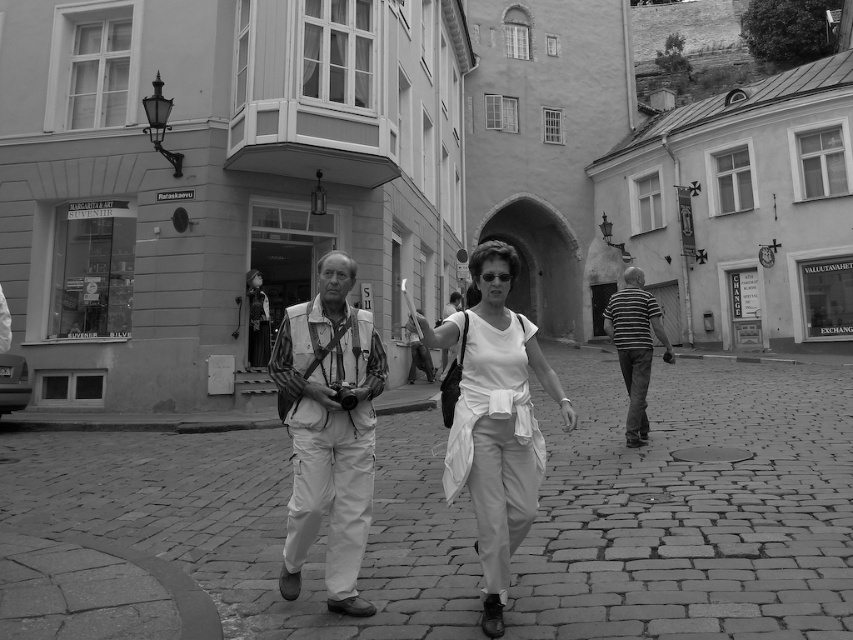
How distant is matte white vest at center from striped cotton shirt at center?

matte white vest at center and striped cotton shirt at center are 5.28 meters apart.

Who is more forward, (326, 465) or (608, 316)?

Positioned in front is point (326, 465).

Between point (305, 464) and point (639, 403), which one is positioned behind?

Positioned behind is point (639, 403).

The image size is (853, 640). I want to click on matte white vest at center, so click(329, 429).

Which is above, matte white vest at center or white cotton shirt at center?

Positioned higher is white cotton shirt at center.

Find the location of a particular element. This screenshot has width=853, height=640. matte white vest at center is located at coordinates (329, 429).

Describe the element at coordinates (329, 429) in the screenshot. The width and height of the screenshot is (853, 640). I see `matte white vest at center` at that location.

Identify the location of matte white vest at center. This screenshot has width=853, height=640. (329, 429).

Does white cotton shirt at center have a lesser width compared to striped cotton shirt at center?

Yes, white cotton shirt at center is thinner than striped cotton shirt at center.

Who is lower down, white cotton shirt at center or striped cotton shirt at center?

Positioned lower is white cotton shirt at center.

Identify the location of white cotton shirt at center. (495, 419).

Locate an element on the screen. This screenshot has height=640, width=853. white cotton shirt at center is located at coordinates (495, 419).